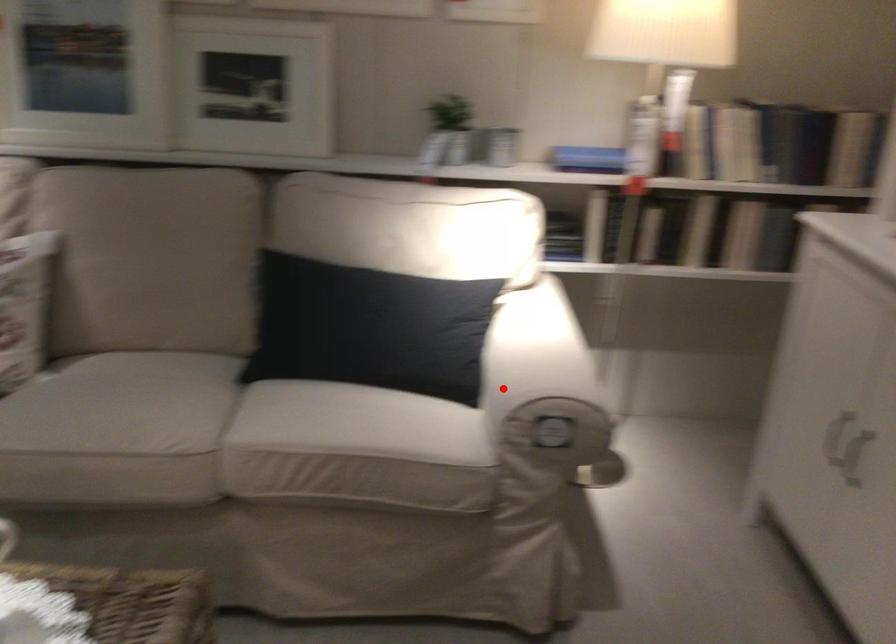
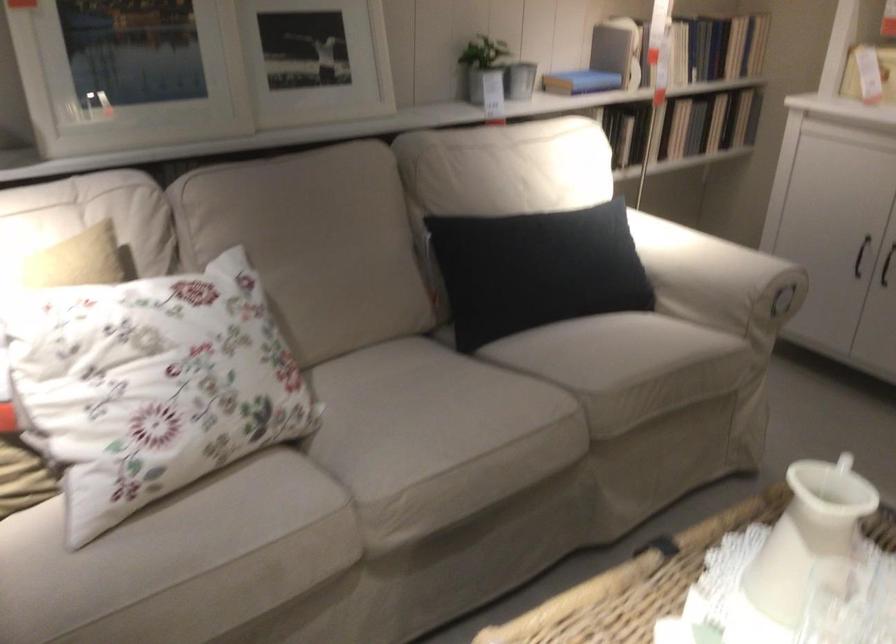
Question: I am providing you with two images of the same scene from different viewpoints. Given a red point in image1, look at the same physical point in image2. Is it:

Choices:
 (A) Closer to the viewpoint
 (B) Farther from the viewpoint

Answer: (B)